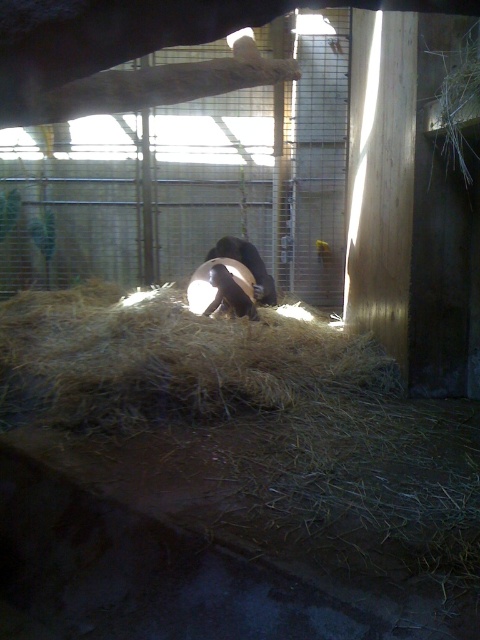
Question: Is brown fur monkey at center below brown fuzzy bear at center?

Choices:
 (A) no
 (B) yes

Answer: (B)

Question: Is brown dry hay at center positioned at the back of brown fuzzy bear at center?

Choices:
 (A) yes
 (B) no

Answer: (B)

Question: Does brown fur monkey at center appear under brown fuzzy bear at center?

Choices:
 (A) yes
 (B) no

Answer: (A)

Question: Which object is farther from the camera taking this photo?

Choices:
 (A) brown dry hay at center
 (B) brown fur monkey at center
 (C) brown fuzzy bear at center

Answer: (C)

Question: Which of these objects is positioned closest to the brown fuzzy bear at center?

Choices:
 (A) brown dry hay at center
 (B) brown fur monkey at center

Answer: (B)

Question: Which point is closer to the camera?

Choices:
 (A) (253, 275)
 (B) (216, 280)
 (C) (257, 344)

Answer: (C)